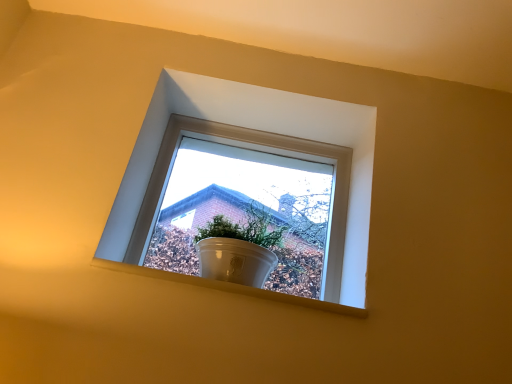
Question: Considering the positions of point (318, 198) and point (153, 127), is point (318, 198) closer or farther from the camera than point (153, 127)?

Choices:
 (A) closer
 (B) farther

Answer: (B)

Question: In the image, is white glossy pot at center positioned in front of or behind white glossy pot at upper center?

Choices:
 (A) behind
 (B) front

Answer: (B)

Question: Which is farther from the white glossy pot at center?

Choices:
 (A) white smooth window sill at center
 (B) white glossy pot at upper center

Answer: (A)

Question: Considering the real-world distances, which object is farthest from the white smooth window sill at center?

Choices:
 (A) white glossy pot at upper center
 (B) white glossy pot at center

Answer: (B)